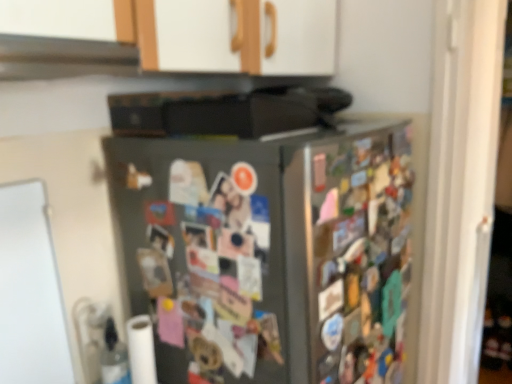
Question: Is satin silver refrigerator at center situated inside black matte exhaust hood at upper center or outside?

Choices:
 (A) outside
 (B) inside

Answer: (A)

Question: Is satin silver refrigerator at center in front of or behind black matte exhaust hood at upper center in the image?

Choices:
 (A) behind
 (B) front

Answer: (A)

Question: Which object is the closest to the white matte toilet paper at lower left?

Choices:
 (A) satin silver refrigerator at center
 (B) black matte exhaust hood at upper center

Answer: (A)

Question: Which object is the farthest from the satin silver refrigerator at center?

Choices:
 (A) white matte toilet paper at lower left
 (B) black matte exhaust hood at upper center

Answer: (B)